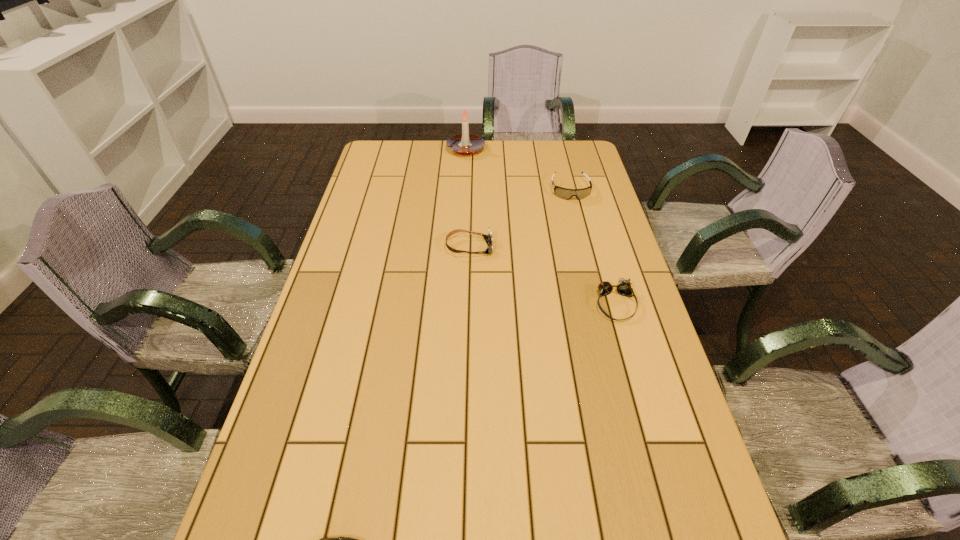
This screenshot has height=540, width=960. In order to click on object located at the far edge in this screenshot , I will do `click(465, 144)`.

In the image, there is a desktop. Where is `free space at the far edge`? This screenshot has width=960, height=540. free space at the far edge is located at coordinates (468, 158).

Where is `free location at the right edge`? free location at the right edge is located at coordinates (701, 519).

Find the location of a particular element. The image size is (960, 540). vacant space that's between the second nearest object and the fourth nearest object is located at coordinates (592, 247).

Locate an element on the screen. free spot between the tallest object and the second farthest object is located at coordinates (518, 170).

Identify the location of unoccupied area between the second nearest object and the fourth nearest object. The image size is (960, 540). tap(592, 247).

This screenshot has height=540, width=960. I want to click on unoccupied area between the nearest goggles and the third farthest object, so (542, 276).

Identify the location of free space between the nearest goggles and the leftmost goggles. The width and height of the screenshot is (960, 540). (542, 276).

Image resolution: width=960 pixels, height=540 pixels. I want to click on free space between the second nearest object and the third farthest object, so click(542, 276).

At what (x,y) coordinates should I click in order to perform the action: click on free spot between the second farthest object and the second nearest goggles. Please return your answer as a coordinate pair (x, y). The image size is (960, 540). Looking at the image, I should click on (519, 219).